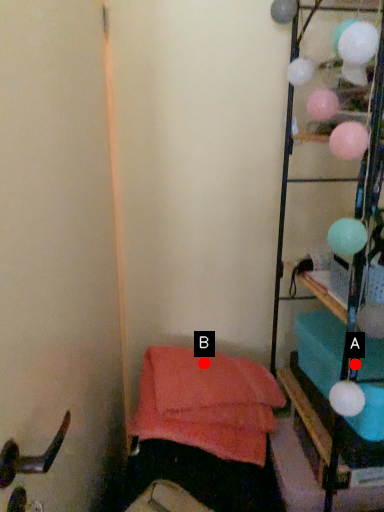
Question: Two points are circled on the image, labeled by A and B beside each circle. Which of the following is the closest to the observer?

Choices:
 (A) A is closer
 (B) B is closer

Answer: (A)